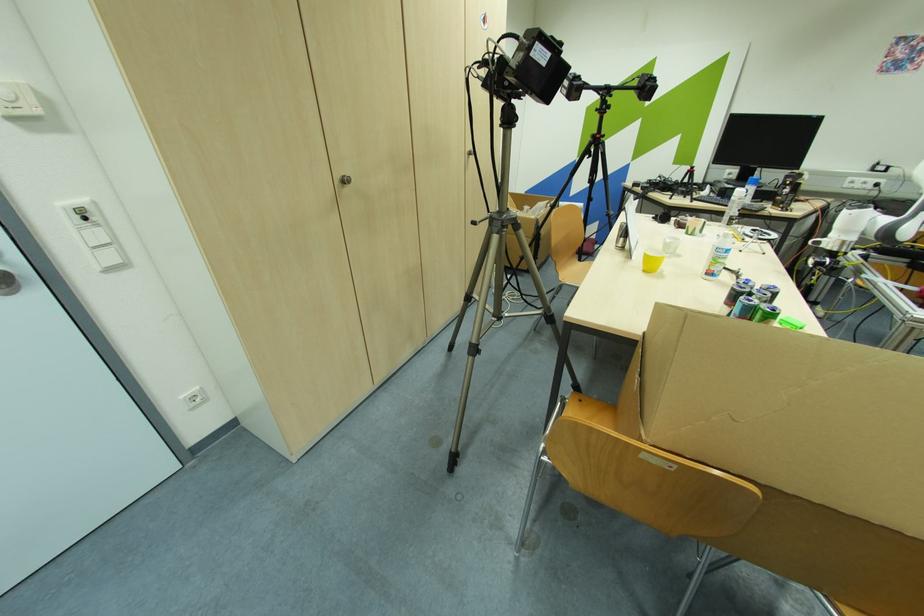
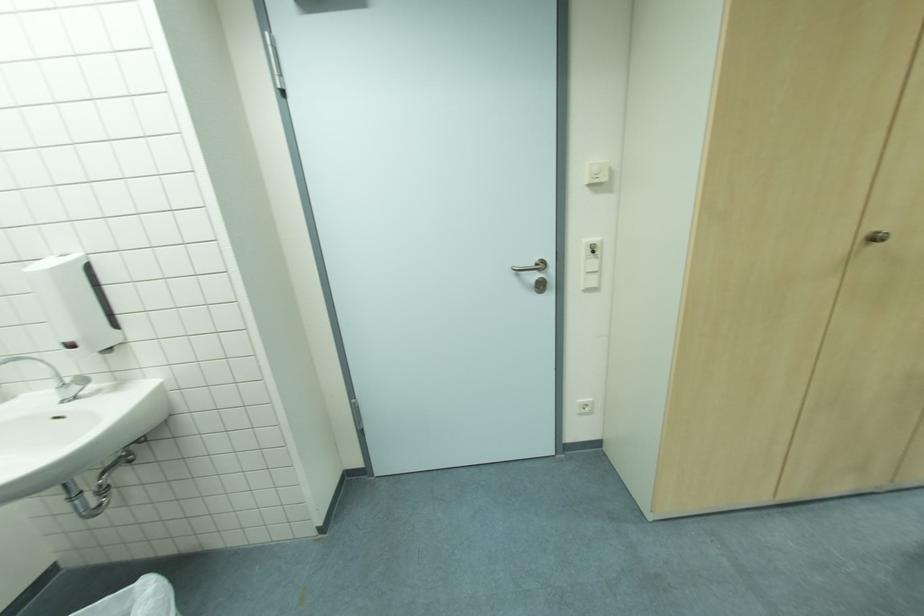
Question: The camera is either moving clockwise (left) or counter-clockwise (right) around the object. The first image is from the beginning of the video and the second image is from the end. Is the camera moving left or right when shooting the video?

Choices:
 (A) Left
 (B) Right

Answer: (B)